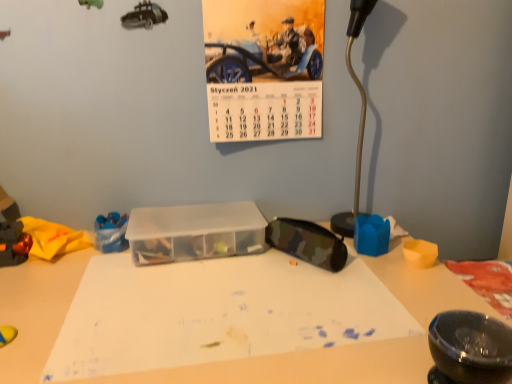
Measure the distance between glossy black bowl at lower right and camera.

The distance of glossy black bowl at lower right from camera is 21.18 inches.

The height and width of the screenshot is (384, 512). What do you see at coordinates (54, 238) in the screenshot? I see `shiny metallic toy car at left, the first toy in the left-to-right sequence` at bounding box center [54, 238].

Identify the location of shiny metallic toy car at left, the third toy from the right. This screenshot has height=384, width=512. (54, 238).

This screenshot has height=384, width=512. I want to click on camo fabric pouch at center-right, so click(307, 242).

What do you see at coordinates (307, 242) in the screenshot?
I see `camo fabric pouch at center-right` at bounding box center [307, 242].

This screenshot has width=512, height=384. Find the location of `glossy black bowl at lower right`. glossy black bowl at lower right is located at coordinates (471, 347).

Is blue foam toy at center-right, marked as the first toy in a right-to-left arrangement, taller or shorter than glossy black bowl at lower right?

Considering their sizes, blue foam toy at center-right, marked as the first toy in a right-to-left arrangement, has less height than glossy black bowl at lower right.

Does blue foam toy at center-right, the 3th toy viewed from the left, have a lesser width compared to glossy black bowl at lower right?

In fact, blue foam toy at center-right, the 3th toy viewed from the left, might be wider than glossy black bowl at lower right.

Considering the relative sizes of blue foam toy at center-right, the 3th toy viewed from the left, and glossy black bowl at lower right in the image provided, is blue foam toy at center-right, the 3th toy viewed from the left, bigger than glossy black bowl at lower right?

Actually, blue foam toy at center-right, the 3th toy viewed from the left, might be smaller than glossy black bowl at lower right.

In the image, is blue foam toy at center-right, marked as the first toy in a right-to-left arrangement, positioned in front of or behind blue plastic toy at lower left, which ranks as the 2th toy in right-to-left order?

In the image, blue foam toy at center-right, marked as the first toy in a right-to-left arrangement, appears behind blue plastic toy at lower left, which ranks as the 2th toy in right-to-left order.

Considering the relative sizes of blue foam toy at center-right, the 3th toy viewed from the left, and blue plastic toy at lower left, acting as the 2th toy starting from the left, in the image provided, is blue foam toy at center-right, the 3th toy viewed from the left, wider than blue plastic toy at lower left, acting as the 2th toy starting from the left,?

No.

Identify the location of toy behind the blue plastic toy at lower left, acting as the 2th toy starting from the left. (371, 235).

Is blue foam toy at center-right, the 3th toy viewed from the left, smaller than blue plastic toy at lower left, which ranks as the 2th toy in right-to-left order?

Indeed, blue foam toy at center-right, the 3th toy viewed from the left, has a smaller size compared to blue plastic toy at lower left, which ranks as the 2th toy in right-to-left order.

Which toy is the 1st one when counting from the left side of the metallic silver lamp at right? Please provide its 2D coordinates.

[(371, 235)]

Does blue foam toy at center-right, the 3th toy viewed from the left, turn towards metallic silver lamp at right?

No, blue foam toy at center-right, the 3th toy viewed from the left, is not oriented towards metallic silver lamp at right.

Is blue foam toy at center-right, the 3th toy viewed from the left, directly adjacent to metallic silver lamp at right?

No, blue foam toy at center-right, the 3th toy viewed from the left, is not touching metallic silver lamp at right.

Considering the positions of objects blue foam toy at center-right, the 3th toy viewed from the left, and metallic silver lamp at right in the image provided, who is more to the left, blue foam toy at center-right, the 3th toy viewed from the left, or metallic silver lamp at right?

Positioned to the left is blue foam toy at center-right, the 3th toy viewed from the left.

Does transparent plastic container at center come in front of shiny metallic toy car at left, the first toy in the left-to-right sequence?

No, the depth of transparent plastic container at center is greater than that of shiny metallic toy car at left, the first toy in the left-to-right sequence.

Is transparent plastic container at center outside of shiny metallic toy car at left, the third toy from the right?

Yes, transparent plastic container at center is outside of shiny metallic toy car at left, the third toy from the right.

Considering the positions of objects transparent plastic container at center and shiny metallic toy car at left, the third toy from the right, in the image provided, who is more to the right, transparent plastic container at center or shiny metallic toy car at left, the third toy from the right,?

From the viewer's perspective, transparent plastic container at center appears more on the right side.

At what (x,y) coordinates should I click in order to perform the action: click on the 2nd toy below the transparent plastic container at center (from the image's perspective). Please return your answer as a coordinate pair (x, y). Image resolution: width=512 pixels, height=384 pixels. Looking at the image, I should click on (54, 238).

Is glossy black bowl at lower right closer to the viewer compared to blue plastic toy at lower left, acting as the 2th toy starting from the left?

Yes.

From the image's perspective, which toy is the 3rd one above the glossy black bowl at lower right? Please provide its 2D coordinates.

[(111, 232)]

From a real-world perspective, is glossy black bowl at lower right positioned above or below blue plastic toy at lower left, which ranks as the 2th toy in right-to-left order?

Clearly, from a real-world perspective, glossy black bowl at lower right is above blue plastic toy at lower left, which ranks as the 2th toy in right-to-left order.

Can you confirm if glossy black bowl at lower right is wider than blue plastic toy at lower left, acting as the 2th toy starting from the left?

No.

Who is bigger, transparent plastic container at center or blue foam toy at center-right, the 3th toy viewed from the left?

transparent plastic container at center.

From their relative heights in the image, would you say transparent plastic container at center is taller or shorter than blue foam toy at center-right, the 3th toy viewed from the left?

transparent plastic container at center is shorter than blue foam toy at center-right, the 3th toy viewed from the left.

From a real-world perspective, is transparent plastic container at center positioned under blue foam toy at center-right, marked as the first toy in a right-to-left arrangement, based on gravity?

Incorrect, from a real-world perspective, transparent plastic container at center is higher than blue foam toy at center-right, marked as the first toy in a right-to-left arrangement.

Which is closer, (x=183, y=242) or (x=122, y=238)?

Point (x=183, y=242)

Is transparent plastic container at center next to blue plastic toy at lower left, which ranks as the 2th toy in right-to-left order?

No, transparent plastic container at center is not with blue plastic toy at lower left, which ranks as the 2th toy in right-to-left order.

How much distance is there between transparent plastic container at center and blue plastic toy at lower left, which ranks as the 2th toy in right-to-left order?

6.24 inches.

Could you tell me if transparent plastic container at center is turned towards blue plastic toy at lower left, acting as the 2th toy starting from the left?

No, transparent plastic container at center does not turn towards blue plastic toy at lower left, acting as the 2th toy starting from the left.

Where is `bowl on the right side of blue foam toy at center-right, marked as the first toy in a right-to-left arrangement`? The height and width of the screenshot is (384, 512). bowl on the right side of blue foam toy at center-right, marked as the first toy in a right-to-left arrangement is located at coordinates (471, 347).

Where is `toy located behind the blue plastic toy at lower left, which ranks as the 2th toy in right-to-left order`? This screenshot has height=384, width=512. toy located behind the blue plastic toy at lower left, which ranks as the 2th toy in right-to-left order is located at coordinates 371,235.

When comparing their distances from glossy black bowl at lower right, does blue plastic toy at lower left, acting as the 2th toy starting from the left, or metallic silver lamp at right seem further?

blue plastic toy at lower left, acting as the 2th toy starting from the left.

Considering their positions, is blue foam toy at center-right, the 3th toy viewed from the left, positioned further to glossy black bowl at lower right than metallic silver lamp at right?

metallic silver lamp at right.

Which object lies nearer to the anchor point transparent plastic container at center, shiny metallic toy car at left, the first toy in the left-to-right sequence, or blue foam toy at center-right, marked as the first toy in a right-to-left arrangement?

shiny metallic toy car at left, the first toy in the left-to-right sequence.

From the image, which object appears to be nearer to blue plastic toy at lower left, which ranks as the 2th toy in right-to-left order, shiny metallic toy car at left, the third toy from the right, or camo fabric pouch at center-right?

shiny metallic toy car at left, the third toy from the right, is positioned closer to the anchor blue plastic toy at lower left, which ranks as the 2th toy in right-to-left order.

Which object lies further to the anchor point camo fabric pouch at center-right, metallic silver lamp at right or blue plastic toy at lower left, acting as the 2th toy starting from the left?

blue plastic toy at lower left, acting as the 2th toy starting from the left.

Considering their positions, is blue foam toy at center-right, the 3th toy viewed from the left, positioned closer to shiny metallic toy car at left, the third toy from the right, than camo fabric pouch at center-right?

camo fabric pouch at center-right.

Which object lies nearer to the anchor point glossy black bowl at lower right, camo fabric pouch at center-right or blue plastic toy at lower left, acting as the 2th toy starting from the left?

camo fabric pouch at center-right lies closer to glossy black bowl at lower right than the other object.

Looking at this image, which object lies nearer to the anchor point shiny metallic toy car at left, the third toy from the right, metallic silver lamp at right or camo fabric pouch at center-right?

Among the two, camo fabric pouch at center-right is located nearer to shiny metallic toy car at left, the third toy from the right.

Locate an element on the screen. toy between shiny metallic toy car at left, the first toy in the left-to-right sequence, and blue foam toy at center-right, the 3th toy viewed from the left, in the horizontal direction is located at coordinates (111, 232).

Image resolution: width=512 pixels, height=384 pixels. I want to click on lamp positioned between glossy black bowl at lower right and transparent plastic container at center from near to far, so click(x=360, y=115).

Where is `goggles between glossy black bowl at lower right and transparent plastic container at center from front to back`? goggles between glossy black bowl at lower right and transparent plastic container at center from front to back is located at coordinates (307, 242).

At what (x,y) coordinates should I click in order to perform the action: click on glass box between blue plastic toy at lower left, which ranks as the 2th toy in right-to-left order, and glossy black bowl at lower right. Please return your answer as a coordinate pair (x, y). Image resolution: width=512 pixels, height=384 pixels. Looking at the image, I should click on (195, 232).